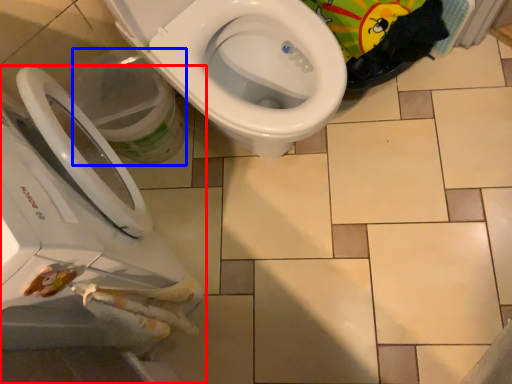
Question: Which of the following is the farthest to the observer, toilet (highlighted by a red box) or potty (highlighted by a blue box)?

Choices:
 (A) toilet
 (B) potty

Answer: (B)